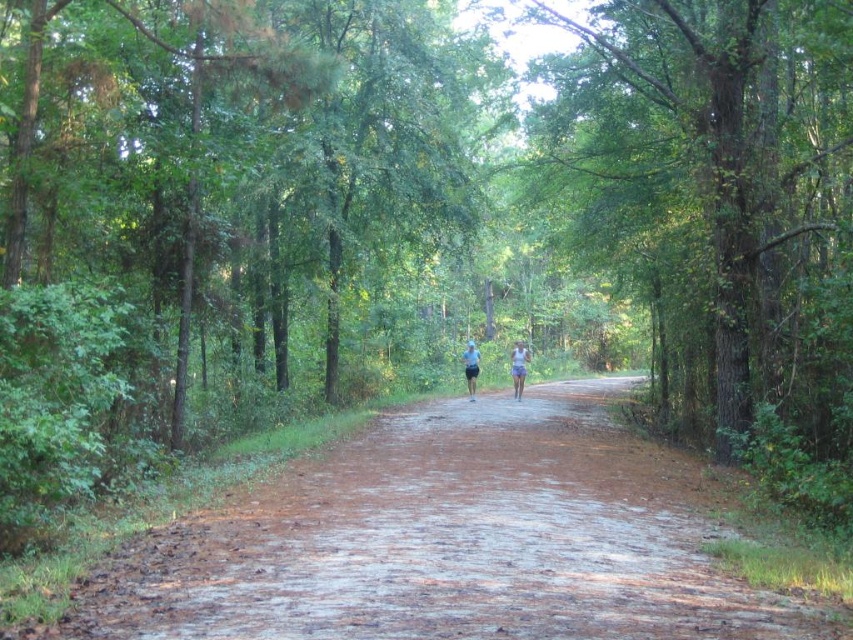
Can you confirm if brown dirt road at center is wider than light blue fabric shorts at center?

Yes.

Is brown dirt road at center smaller than light blue fabric shorts at center?

Yes.

Is point (461, 497) behind point (514, 390)?

No, it is in front of (514, 390).

Find the location of a particular element. This screenshot has width=853, height=640. brown dirt road at center is located at coordinates (451, 540).

Is green leafy tree at center thinner than white fabric shirt at center?

Incorrect, green leafy tree at center's width is not less than white fabric shirt at center's.

Between green leafy tree at center and white fabric shirt at center, which one is positioned lower?

white fabric shirt at center is below.

Describe the element at coordinates (718, 192) in the screenshot. The width and height of the screenshot is (853, 640). I see `green leafy tree at center` at that location.

Where is `green leafy tree at center`? The height and width of the screenshot is (640, 853). green leafy tree at center is located at coordinates (718, 192).

From the picture: Between light blue fabric shorts at center and white fabric shorts at center, which one is positioned higher?

white fabric shorts at center

Can you confirm if light blue fabric shorts at center is thinner than white fabric shorts at center?

No, light blue fabric shorts at center is not thinner than white fabric shorts at center.

Between point (468, 360) and point (524, 378), which one is positioned behind?

Point (468, 360)

The height and width of the screenshot is (640, 853). In order to click on light blue fabric shorts at center in this screenshot , I will do `click(518, 365)`.